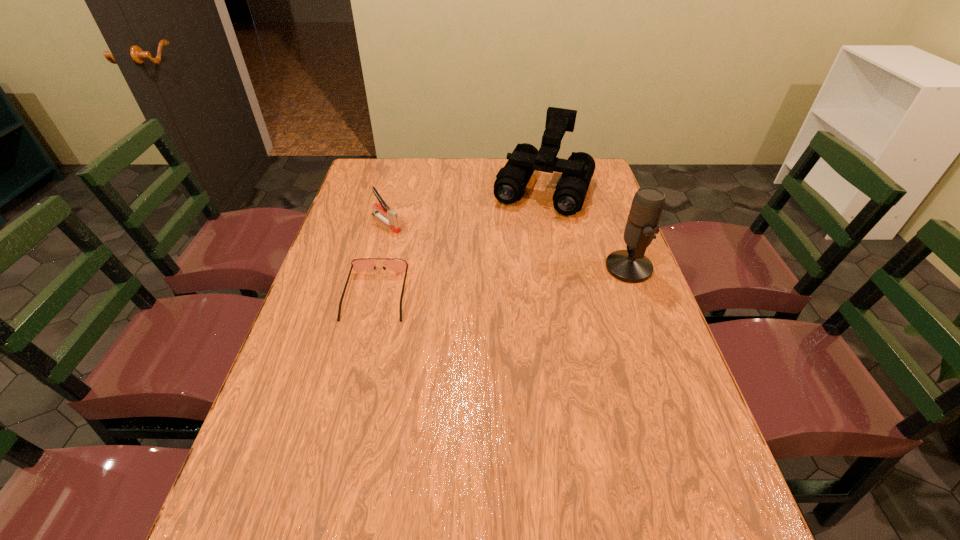
Locate an element on the screen. This screenshot has width=960, height=540. free region at the right edge of the desktop is located at coordinates (622, 237).

The height and width of the screenshot is (540, 960). Identify the location of vacant region at the far left corner of the desktop. (368, 174).

Identify the location of vacant space at the near right corner. (698, 474).

You are a GUI agent. You are given a task and a screenshot of the screen. Output one action in this format:
    pyautogui.click(x=<x>, y=<y>)
    Task: Click on the vacant region between the binoculars and the sunglasses
    The height and width of the screenshot is (540, 960).
    Given the screenshot: What is the action you would take?
    pyautogui.click(x=460, y=242)

Where is `vacant space that is in between the stapler and the binoculars`? This screenshot has height=540, width=960. vacant space that is in between the stapler and the binoculars is located at coordinates (465, 206).

You are a GUI agent. You are given a task and a screenshot of the screen. Output one action in this format:
    pyautogui.click(x=<x>, y=<y>)
    Task: Click on the vacant region between the microphone and the shortest object
    
    Given the screenshot: What is the action you would take?
    pyautogui.click(x=502, y=281)

Identify the location of vacant space that's between the stapler and the binoculars. The image size is (960, 540). (465, 206).

This screenshot has height=540, width=960. What are the coordinates of `vacant space that is in between the third tallest object and the shortest object` in the screenshot? It's located at (381, 259).

This screenshot has width=960, height=540. Find the location of `free space between the binoculars and the shortest object`. free space between the binoculars and the shortest object is located at coordinates (460, 242).

Locate an element on the screen. empty space that is in between the binoculars and the stapler is located at coordinates (465, 206).